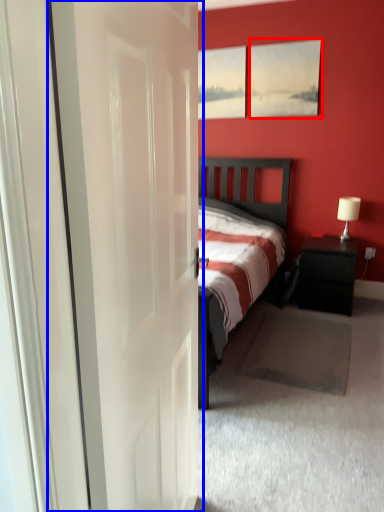
Question: Which of the following is the farthest to the observer, picture frame (highlighted by a red box) or door (highlighted by a blue box)?

Choices:
 (A) picture frame
 (B) door

Answer: (A)